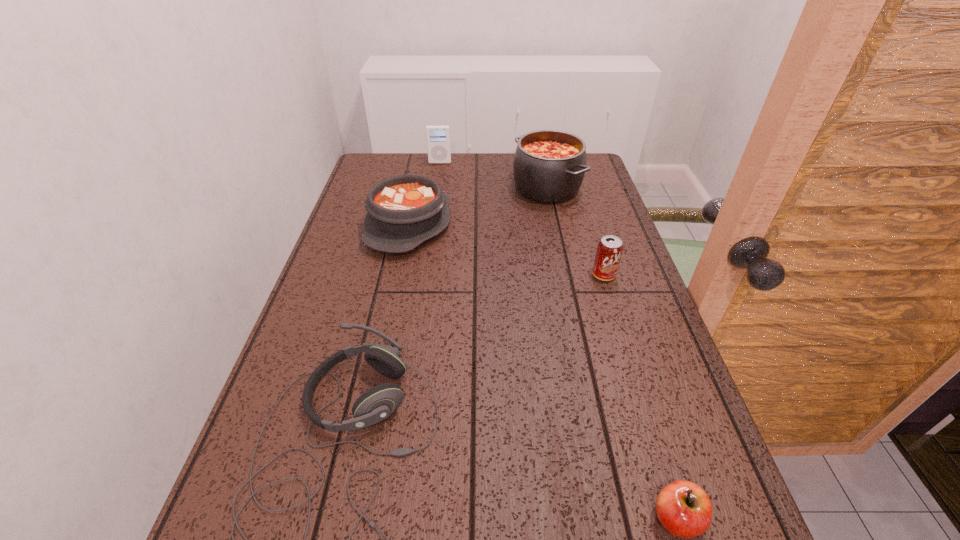
Find the location of a particular element. This screenshot has width=960, height=540. the taller casserole is located at coordinates [x=549, y=166].

Image resolution: width=960 pixels, height=540 pixels. In order to click on the farthest object in this screenshot , I will do `click(438, 136)`.

Where is `the shorter casserole`? This screenshot has height=540, width=960. the shorter casserole is located at coordinates click(404, 211).

You are a GUI agent. You are given a task and a screenshot of the screen. Output one action in this format:
    pyautogui.click(x=<x>, y=<y>)
    Task: Click on the third nearest object
    
    Given the screenshot: What is the action you would take?
    pyautogui.click(x=609, y=250)

The image size is (960, 540). In order to click on free space located 0.260m on the left of the taller casserole in this screenshot , I will do click(x=434, y=188).

You are a GUI agent. You are given a task and a screenshot of the screen. Output one action in this format:
    pyautogui.click(x=<x>, y=<y>)
    Task: Click on the free space located 0.080m on the front-facing side of the farthest object
    This screenshot has width=960, height=540.
    Given the screenshot: What is the action you would take?
    pyautogui.click(x=438, y=175)

The width and height of the screenshot is (960, 540). Find the location of `blank space located 0.060m on the left of the left casserole`. blank space located 0.060m on the left of the left casserole is located at coordinates (347, 225).

In order to click on free space located 0.130m on the front of the soda can in this screenshot , I will do `click(618, 321)`.

This screenshot has height=540, width=960. I want to click on casserole at the far edge, so click(549, 166).

You are a GUI agent. You are given a task and a screenshot of the screen. Output one action in this format:
    pyautogui.click(x=<x>, y=<y>)
    Task: Click on the iPod at the far edge
    This screenshot has width=960, height=540.
    Given the screenshot: What is the action you would take?
    pyautogui.click(x=438, y=136)